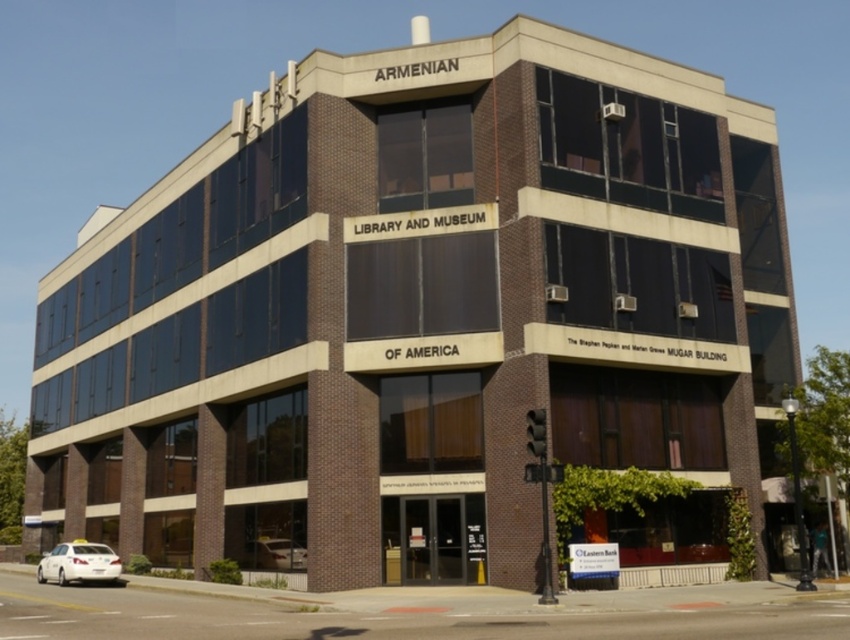
Question: Is white matte taxi cab at lower left closer to the viewer compared to white glossy car at lower center?

Choices:
 (A) yes
 (B) no

Answer: (B)

Question: Among these objects, which one is farthest from the camera?

Choices:
 (A) white glossy car at lower center
 (B) white matte taxi cab at lower left

Answer: (B)

Question: Is white matte taxi cab at lower left smaller than white glossy car at lower center?

Choices:
 (A) yes
 (B) no

Answer: (B)

Question: From the image, what is the correct spatial relationship of white matte taxi cab at lower left in relation to white glossy car at lower center?

Choices:
 (A) below
 (B) above

Answer: (A)